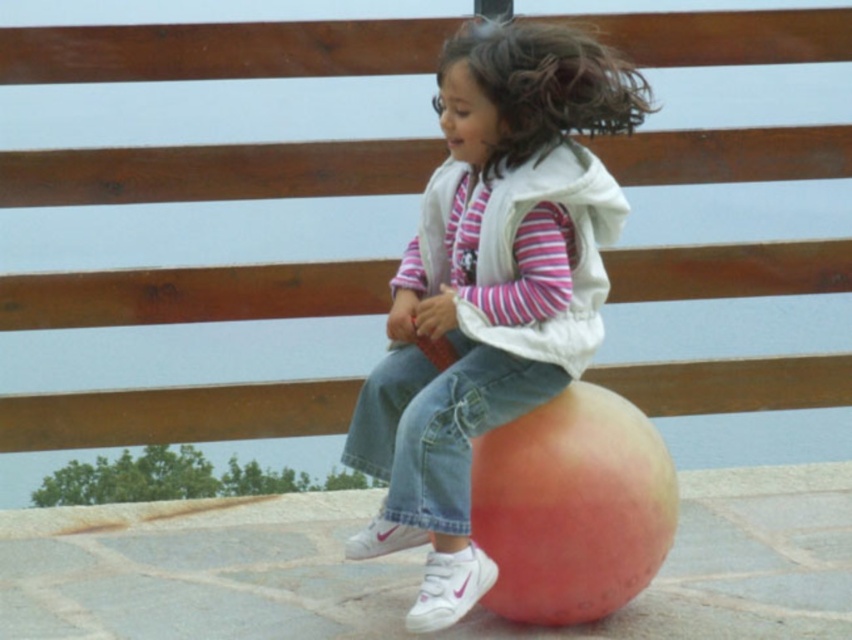
Between pink matte ball at center and curly brown hair at upper center, which one is positioned lower?

pink matte ball at center is lower down.

Is point (459, 252) positioned before point (556, 92)?

No, it is behind (556, 92).

Locate an element on the screen. This screenshot has width=852, height=640. pink matte ball at center is located at coordinates (490, 285).

Does white fleece vest at center have a larger size compared to curly brown hair at upper center?

Incorrect, white fleece vest at center is not larger than curly brown hair at upper center.

Is point (481, 339) closer to viewer compared to point (603, 52)?

That is True.

Describe the element at coordinates (573, 269) in the screenshot. This screenshot has width=852, height=640. I see `white fleece vest at center` at that location.

Where is `white fleece vest at center`? This screenshot has height=640, width=852. white fleece vest at center is located at coordinates (573, 269).

In the scene shown: Who is more distant from viewer, [547,99] or [586,221]?

The point [586,221] is behind.

Does pink matte ball at center appear under white fleece vest at center?

Correct, pink matte ball at center is located below white fleece vest at center.

I want to click on pink matte ball at center, so click(490, 285).